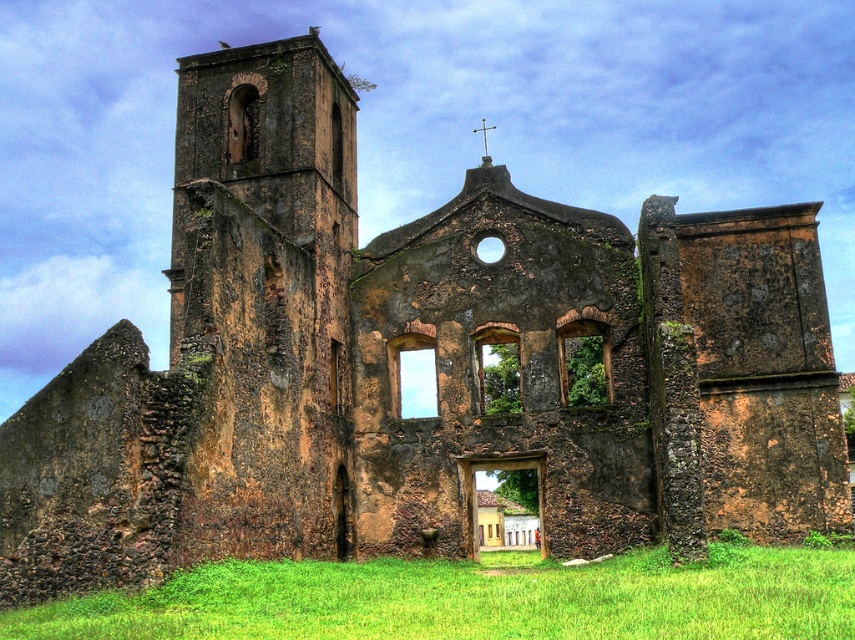
You are standing on the green grass at lower center near the ruins of an old church. You want to climb up to the rusty stone tower at left. Which direction should you move to reach it?

The rusty stone tower at left is positioned over green grass at lower center, so you should move towards the left to reach it.

You are a drone operator trying to capture aerial footage of the rusty stone tower at left and the green grass at lower center. If you want to ensure both are visible in the same frame, what should you do?

Since the rusty stone tower at left is much taller than the green grass at lower center, you should position the drone at a higher altitude to capture both the height of the tower and the lower grass in the same frame.

You are standing in front of the ruins of an old church. You see two points marked on the structure. The first point is at coordinates point (186, 291) and the second is at point (293, 625). Which point is closer to you?

Point (186, 291) is further to the camera than point (293, 625). Therefore, the point closer to you is point (293, 625).